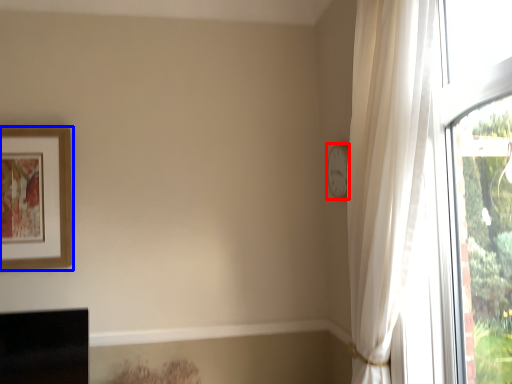
Question: Which object is further to the camera taking this photo, clock (highlighted by a red box) or picture frame (highlighted by a blue box)?

Choices:
 (A) clock
 (B) picture frame

Answer: (B)